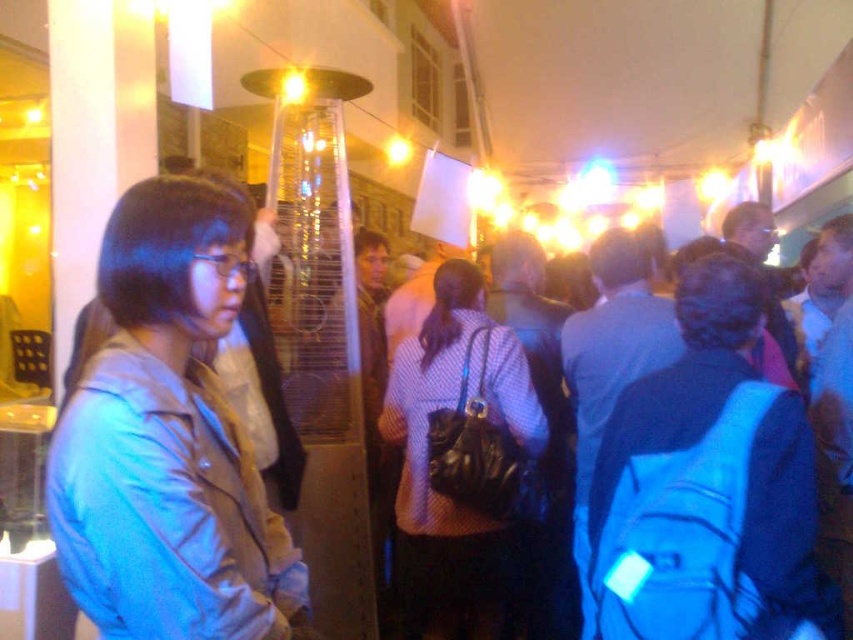
You are at the point labeled point (294, 627) and want to walk to the point labeled point (422, 404). Which direction should you move to reach your destination?

You should move backward because point (294, 627) is in front of point (422, 404), so moving backward will take you toward the destination.

You are a person standing at the entrance of the corridor. You want to greet the person wearing the matte gray jacket at left and the person wearing the polka dot shirt at center. Which one can you reach first if you walk straight ahead?

The matte gray jacket at left is closer to you than the polka dot shirt at center, so you can reach the person wearing the matte gray jacket at left first.

You are standing in the corridor and want to greet the person wearing the matte gray jacket at left and the person wearing the polka dot shirt at center. Which person should you approach first if you want to greet the one closer to you?

The matte gray jacket at left is above the polka dot shirt at center, so the person wearing the polka dot shirt at center is closer to you. Approach them first.